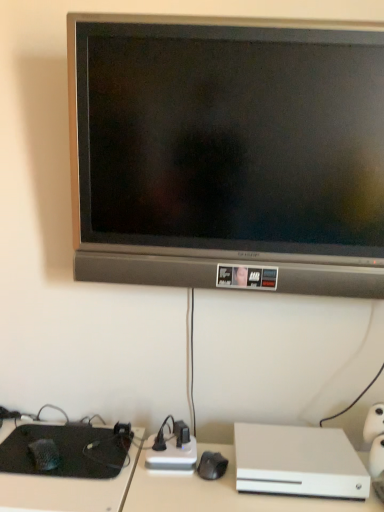
Question: Choose the correct answer: Is black matte keyboard at lower left inside matte black tv at upper center or outside it?

Choices:
 (A) inside
 (B) outside

Answer: (B)

Question: Based on their positions, is black matte keyboard at lower left located to the left or right of matte black tv at upper center?

Choices:
 (A) right
 (B) left

Answer: (B)

Question: Which object is positioned farthest from the matte black tv at upper center?

Choices:
 (A) black matte keyboard at lower left
 (B) white matte xbox one at lower right

Answer: (A)

Question: Which object is the closest to the matte black tv at upper center?

Choices:
 (A) black matte keyboard at lower left
 (B) white matte xbox one at lower right

Answer: (B)